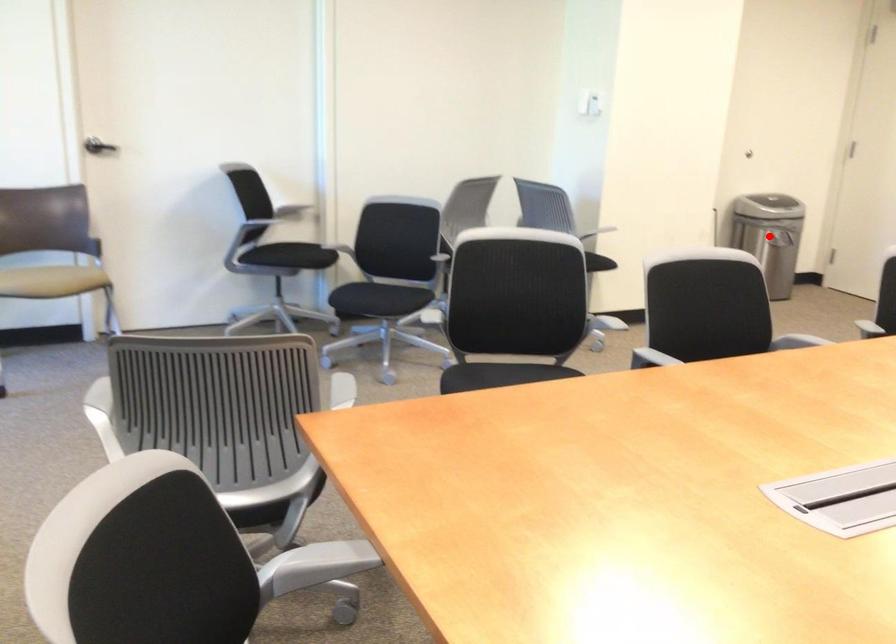
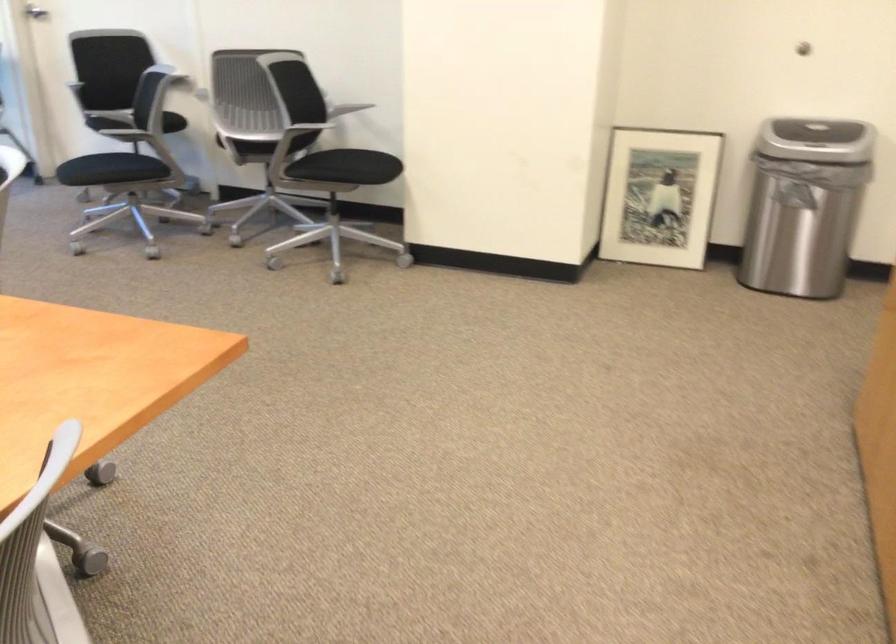
Question: I am providing you with two images of the same scene from different viewpoints. A red point is marked on the first image. Can you still see the location of the red point in image 2?

Choices:
 (A) Yes
 (B) No

Answer: (B)